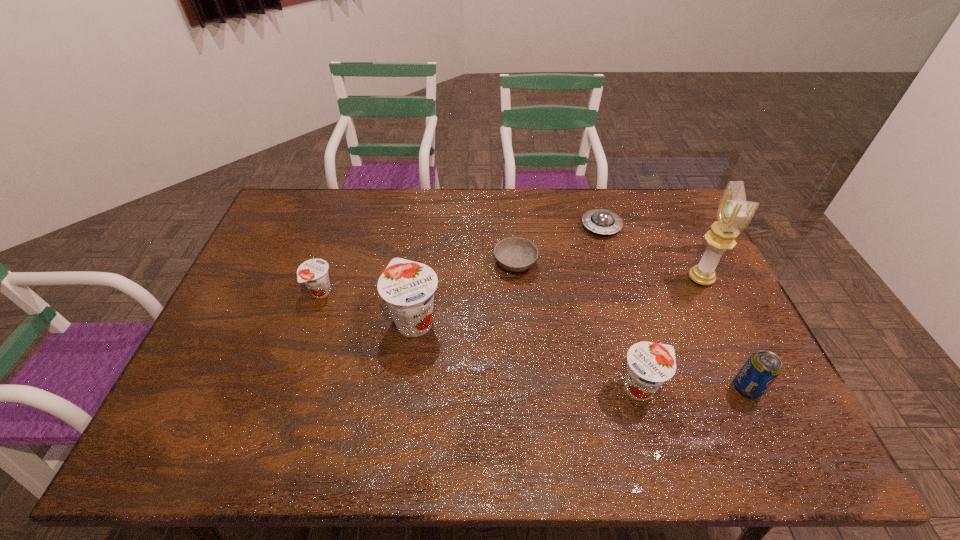
Identify which object is the nearest to the award. Please provide its 2D coordinates. Your answer should be formatted as a tuple, i.e. [(x, y)], where the tuple contains the x and y coordinates of a point satisfying the conditions above.

[(601, 221)]

Where is `yogurt identified as the third closest to the award`? Image resolution: width=960 pixels, height=540 pixels. yogurt identified as the third closest to the award is located at coordinates (314, 273).

Where is `yogurt that stands as the second closest to the rightmost yogurt`? yogurt that stands as the second closest to the rightmost yogurt is located at coordinates (314, 273).